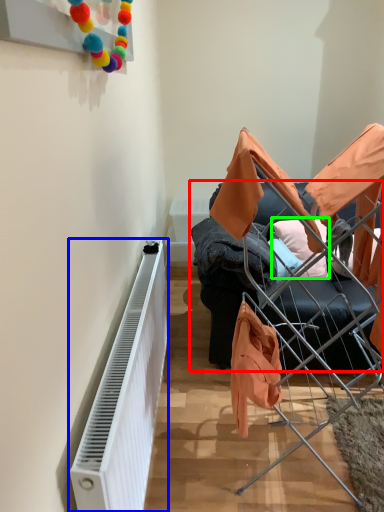
Question: Which object is positioned closest to furniture (highlighted by a red box)? Select from radiator (highlighted by a blue box) and pillow (highlighted by a green box).

Choices:
 (A) radiator
 (B) pillow

Answer: (B)